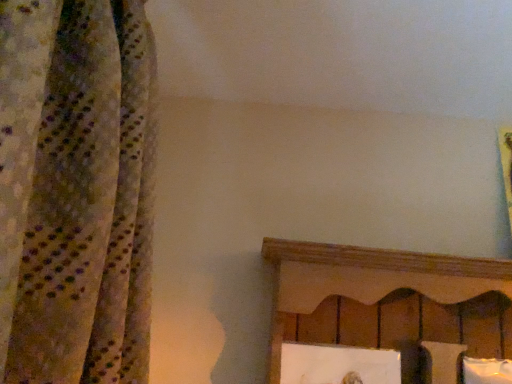
Question: Can you see white soft pillow at lower right touching white matte picture frame at lower center?

Choices:
 (A) no
 (B) yes

Answer: (A)

Question: Considering the relative sizes of white soft pillow at lower right and white matte picture frame at lower center in the image provided, is white soft pillow at lower right bigger than white matte picture frame at lower center?

Choices:
 (A) yes
 (B) no

Answer: (A)

Question: Could you tell me if white soft pillow at lower right is turned towards white matte picture frame at lower center?

Choices:
 (A) yes
 (B) no

Answer: (B)

Question: Does white soft pillow at lower right appear on the left side of white matte picture frame at lower center?

Choices:
 (A) no
 (B) yes

Answer: (A)

Question: Does white soft pillow at lower right have a greater width compared to white matte picture frame at lower center?

Choices:
 (A) no
 (B) yes

Answer: (B)

Question: Does white soft pillow at lower right appear on the right side of white matte picture frame at lower center?

Choices:
 (A) no
 (B) yes

Answer: (B)

Question: Does white matte picture frame at lower center have a lesser height compared to white soft pillow at lower right?

Choices:
 (A) no
 (B) yes

Answer: (B)

Question: Can you confirm if white matte picture frame at lower center is bigger than white soft pillow at lower right?

Choices:
 (A) yes
 (B) no

Answer: (B)

Question: From the image's perspective, does white matte picture frame at lower center appear higher than white soft pillow at lower right?

Choices:
 (A) no
 (B) yes

Answer: (B)

Question: Does white matte picture frame at lower center appear on the right side of white soft pillow at lower right?

Choices:
 (A) no
 (B) yes

Answer: (A)

Question: From a real-world perspective, is white matte picture frame at lower center physically below white soft pillow at lower right?

Choices:
 (A) no
 (B) yes

Answer: (A)

Question: Could you tell me if white matte picture frame at lower center is turned towards white soft pillow at lower right?

Choices:
 (A) no
 (B) yes

Answer: (A)

Question: Is white matte picture frame at lower center to the left or to the right of white soft pillow at lower right in the image?

Choices:
 (A) left
 (B) right

Answer: (A)